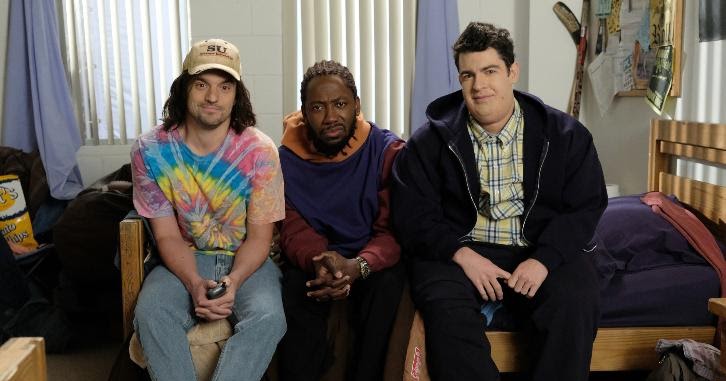
At what (x,y) coordinates should I click in order to perform the action: click on window curtains. Please return your answer as a coordinate pair (x, y). The width and height of the screenshot is (726, 381). Looking at the image, I should click on (30, 25), (41, 117), (430, 24), (417, 120).